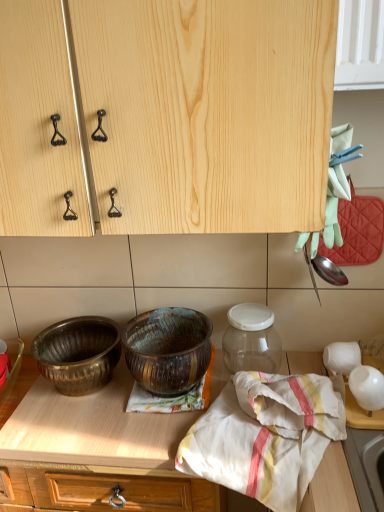
Describe the element at coordinates (92, 425) in the screenshot. The image size is (384, 512). I see `wooden at center` at that location.

Image resolution: width=384 pixels, height=512 pixels. What do you see at coordinates (367, 387) in the screenshot? I see `white glossy vase at right` at bounding box center [367, 387].

The width and height of the screenshot is (384, 512). Describe the element at coordinates (258, 448) in the screenshot. I see `white cotton cloth at center` at that location.

Describe the element at coordinates (78, 353) in the screenshot. I see `polished brass bowl at lower left, which is the second bowl from right to left` at that location.

How much space does polished brass bowl at lower left, which is counted as the first bowl, starting from the left, occupy horizontally?

The width of polished brass bowl at lower left, which is counted as the first bowl, starting from the left, is 8.96 inches.

Find the location of `transparent glass jar at center`. transparent glass jar at center is located at coordinates (251, 340).

The image size is (384, 512). What do you see at coordinates (168, 349) in the screenshot?
I see `rusty metallic bowl at center, the 1th bowl in the right-to-left sequence` at bounding box center [168, 349].

What do you see at coordinates (166, 115) in the screenshot? I see `natural wood cabinet at upper center` at bounding box center [166, 115].

This screenshot has height=512, width=384. I want to click on wooden at center, so click(x=92, y=425).

Does white glossy vase at right touch polished brass bowl at lower left, which is counted as the first bowl, starting from the left?

No, white glossy vase at right is not in contact with polished brass bowl at lower left, which is counted as the first bowl, starting from the left.

Consider the image. From a real-world perspective, who is located higher, white glossy vase at right or polished brass bowl at lower left, which is counted as the first bowl, starting from the left?

polished brass bowl at lower left, which is counted as the first bowl, starting from the left.

How distant is white glossy vase at right from polished brass bowl at lower left, which is the second bowl from right to left?

white glossy vase at right is 25.10 inches away from polished brass bowl at lower left, which is the second bowl from right to left.

Considering their positions, is white glossy vase at right located in front of or behind polished brass bowl at lower left, which is the second bowl from right to left?

Clearly, white glossy vase at right is in front of polished brass bowl at lower left, which is the second bowl from right to left.

Is rusty metallic bowl at center, the 1th bowl in the right-to-left sequence, located outside polished brass bowl at lower left, which is counted as the first bowl, starting from the left?

Yes, rusty metallic bowl at center, the 1th bowl in the right-to-left sequence, is outside of polished brass bowl at lower left, which is counted as the first bowl, starting from the left.

Which object is wider, rusty metallic bowl at center, placed as the 2th bowl when sorted from left to right, or polished brass bowl at lower left, which is the second bowl from right to left?

polished brass bowl at lower left, which is the second bowl from right to left, is wider.

Between rusty metallic bowl at center, placed as the 2th bowl when sorted from left to right, and polished brass bowl at lower left, which is counted as the first bowl, starting from the left, which one has smaller size?

polished brass bowl at lower left, which is counted as the first bowl, starting from the left, is smaller.

Can you tell me how much rusty metallic bowl at center, placed as the 2th bowl when sorted from left to right, and polished brass bowl at lower left, which is the second bowl from right to left, differ in facing direction?

The angle between the facing direction of rusty metallic bowl at center, placed as the 2th bowl when sorted from left to right, and the facing direction of polished brass bowl at lower left, which is the second bowl from right to left, is 0.00104 degrees.

Can you tell me how much rusty metallic bowl at center, placed as the 2th bowl when sorted from left to right, and wooden at center differ in facing direction?

rusty metallic bowl at center, placed as the 2th bowl when sorted from left to right, and wooden at center are facing 0.16 degrees away from each other.

Does point (122, 334) come in front of point (10, 443)?

No, it is behind (10, 443).

From the image's perspective, between rusty metallic bowl at center, placed as the 2th bowl when sorted from left to right, and wooden at center, which one is located above?

rusty metallic bowl at center, placed as the 2th bowl when sorted from left to right.

From a real-world perspective, is rusty metallic bowl at center, placed as the 2th bowl when sorted from left to right, below wooden at center?

No, from a real-world perspective, rusty metallic bowl at center, placed as the 2th bowl when sorted from left to right, is not below wooden at center.

Is white cotton cloth at center facing away from transparent glass jar at center?

Yes, white cotton cloth at center is positioned with its back facing transparent glass jar at center.

What are the coordinates of `blanket in front of the transparent glass jar at center` in the screenshot? It's located at pos(258,448).

Does white cotton cloth at center have a greater height compared to transparent glass jar at center?

Indeed, white cotton cloth at center has a greater height compared to transparent glass jar at center.

Is white cotton cloth at center taller or shorter than rusty metallic bowl at center, placed as the 2th bowl when sorted from left to right?

Clearly, white cotton cloth at center is taller compared to rusty metallic bowl at center, placed as the 2th bowl when sorted from left to right.

Is rusty metallic bowl at center, the 1th bowl in the right-to-left sequence, at the back of white cotton cloth at center?

No.

From the picture: Which is correct: white cotton cloth at center is inside rusty metallic bowl at center, the 1th bowl in the right-to-left sequence, or outside of it?

white cotton cloth at center is not inside rusty metallic bowl at center, the 1th bowl in the right-to-left sequence, it's outside.

Between polished brass bowl at lower left, which is the second bowl from right to left, and transparent glass jar at center, which one appears on the left side from the viewer's perspective?

polished brass bowl at lower left, which is the second bowl from right to left.

From the picture: Who is shorter, polished brass bowl at lower left, which is the second bowl from right to left, or transparent glass jar at center?

polished brass bowl at lower left, which is the second bowl from right to left, is shorter.

Could transparent glass jar at center be considered to be inside polished brass bowl at lower left, which is counted as the first bowl, starting from the left?

No, transparent glass jar at center is located outside of polished brass bowl at lower left, which is counted as the first bowl, starting from the left.

How different are the orientations of polished brass bowl at lower left, which is counted as the first bowl, starting from the left, and transparent glass jar at center in degrees?

0.281 degrees separate the facing orientations of polished brass bowl at lower left, which is counted as the first bowl, starting from the left, and transparent glass jar at center.

Is polished brass bowl at lower left, which is the second bowl from right to left, taller or shorter than white glossy vase at right?

polished brass bowl at lower left, which is the second bowl from right to left, is taller than white glossy vase at right.

Between point (79, 378) and point (379, 384), which one is positioned behind?

The point (79, 378) is farther.

Considering the sizes of objects polished brass bowl at lower left, which is the second bowl from right to left, and white glossy vase at right in the image provided, who is bigger, polished brass bowl at lower left, which is the second bowl from right to left, or white glossy vase at right?

Bigger between the two is polished brass bowl at lower left, which is the second bowl from right to left.

Could you tell me if polished brass bowl at lower left, which is counted as the first bowl, starting from the left, is turned towards white glossy vase at right?

No, polished brass bowl at lower left, which is counted as the first bowl, starting from the left, is not aimed at white glossy vase at right.

Identify the location of tableware that appears on the right of polished brass bowl at lower left, which is counted as the first bowl, starting from the left. (367, 387).

Identify the location of bowl behind the rusty metallic bowl at center, placed as the 2th bowl when sorted from left to right. (78, 353).

From the image, which object appears to be nearer to transparent glass jar at center, wooden at center or white glossy vase at right?

wooden at center is closer to transparent glass jar at center.

Which object lies further to the anchor point natural wood cabinet at upper center, wooden at center or transparent glass jar at center?

The object further to natural wood cabinet at upper center is wooden at center.

When comparing their distances from transparent glass jar at center, does wooden at center or natural wood cabinet at upper center seem further?

natural wood cabinet at upper center is further to transparent glass jar at center.

From the image, which object appears to be farther from wooden at center, white cotton cloth at center or polished brass bowl at lower left, which is the second bowl from right to left?

white cotton cloth at center lies further to wooden at center than the other object.

Looking at the image, which one is located closer to white cotton cloth at center, polished brass bowl at lower left, which is the second bowl from right to left, or white glossy vase at right?

white glossy vase at right is closer to white cotton cloth at center.

From the image, which object appears to be farther from white cotton cloth at center, rusty metallic bowl at center, the 1th bowl in the right-to-left sequence, or wooden at center?

Among the two, rusty metallic bowl at center, the 1th bowl in the right-to-left sequence, is located further to white cotton cloth at center.

When comparing their distances from white cotton cloth at center, does natural wood cabinet at upper center or transparent glass jar at center seem closer?

The object closer to white cotton cloth at center is transparent glass jar at center.

Based on their spatial positions, is transparent glass jar at center or white cotton cloth at center further from polished brass bowl at lower left, which is counted as the first bowl, starting from the left?

white cotton cloth at center is further to polished brass bowl at lower left, which is counted as the first bowl, starting from the left.

You are a GUI agent. You are given a task and a screenshot of the screen. Output one action in this format:
    pyautogui.click(x=<x>, y=<y>)
    Task: Click on the blanket between natural wood cabinet at upper center and wooden at center vertically
    The height and width of the screenshot is (512, 384).
    Given the screenshot: What is the action you would take?
    pyautogui.click(x=258, y=448)

At what (x,y) coordinates should I click in order to perform the action: click on glass jar between natural wood cabinet at upper center and white cotton cloth at center vertically. Please return your answer as a coordinate pair (x, y). Looking at the image, I should click on (251, 340).

Find the location of `glass jar situated between polished brass bowl at lower left, which is the second bowl from right to left, and white cotton cloth at center from left to right`. glass jar situated between polished brass bowl at lower left, which is the second bowl from right to left, and white cotton cloth at center from left to right is located at coordinates (251, 340).

The width and height of the screenshot is (384, 512). Find the location of `glass jar between polished brass bowl at lower left, which is counted as the first bowl, starting from the left, and white glossy vase at right, in the horizontal direction`. glass jar between polished brass bowl at lower left, which is counted as the first bowl, starting from the left, and white glossy vase at right, in the horizontal direction is located at coordinates coord(251,340).